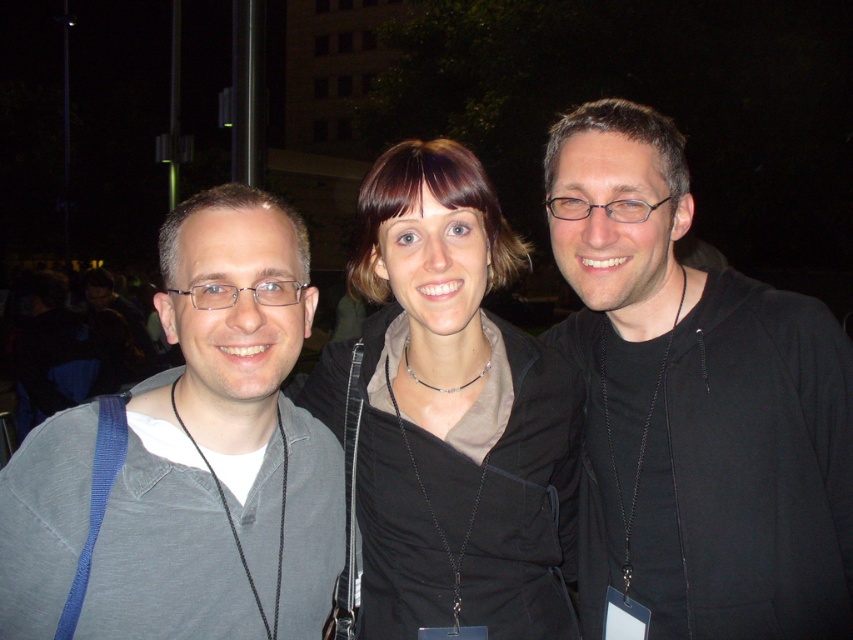
Is gray cotton shirt at left to the left of black matte jacket at center from the viewer's perspective?

Yes, gray cotton shirt at left is to the left of black matte jacket at center.

Where is `gray cotton shirt at left`? Image resolution: width=853 pixels, height=640 pixels. gray cotton shirt at left is located at coordinates (222, 445).

Where is `gray cotton shirt at left`? This screenshot has height=640, width=853. gray cotton shirt at left is located at coordinates (222, 445).

Does black matte jacket at right have a lesser width compared to black matte jacket at center?

Yes.

Between point (804, 444) and point (554, 378), which one is positioned behind?

The point (554, 378) is behind.

Is point (625, 337) more distant than point (344, 369)?

Yes, point (625, 337) is behind point (344, 369).

Locate an element on the screen. This screenshot has width=853, height=640. black matte jacket at right is located at coordinates pyautogui.click(x=694, y=404).

Measure the distance from black matte jacket at right to gray cotton shirt at left.

They are 24.45 inches apart.

Is black matte jacket at right bigger than gray cotton shirt at left?

Correct, black matte jacket at right is larger in size than gray cotton shirt at left.

Is point (675, 435) positioned in front of point (10, 509)?

That is False.

At what (x,y) coordinates should I click in order to perform the action: click on black matte jacket at right. Please return your answer as a coordinate pair (x, y). This screenshot has width=853, height=640. Looking at the image, I should click on (694, 404).